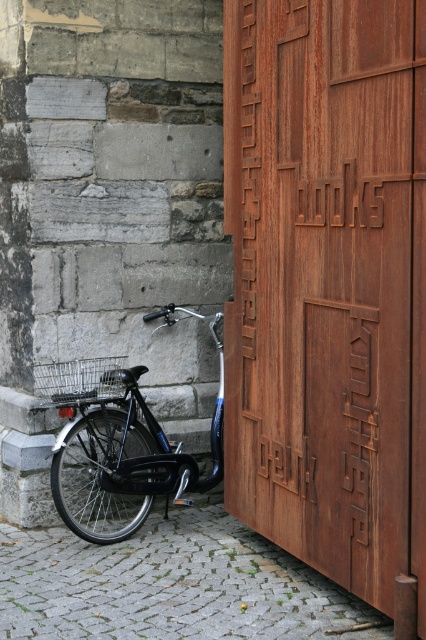
Can you confirm if rusty metal door at center is wider than shiny black bicycle at lower left?

No, rusty metal door at center is not wider than shiny black bicycle at lower left.

Is rusty metal door at center bigger than shiny black bicycle at lower left?

Correct, rusty metal door at center is larger in size than shiny black bicycle at lower left.

Who is more forward, (420,83) or (120,496)?

Point (420,83) is in front.

This screenshot has height=640, width=426. Identify the location of rusty metal door at center. (328, 284).